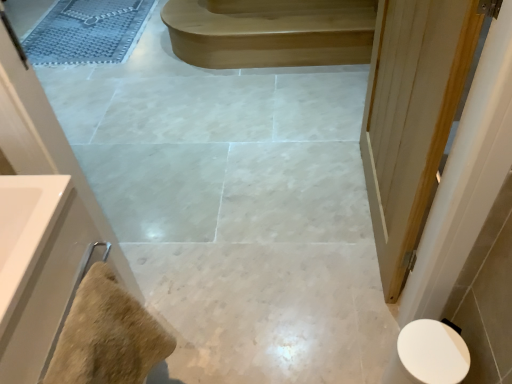
Question: Could you tell me if light brown wood stair at upper center is turned towards beige textured towel at lower left?

Choices:
 (A) yes
 (B) no

Answer: (B)

Question: From a real-world perspective, is light brown wood stair at upper center on beige textured towel at lower left?

Choices:
 (A) no
 (B) yes

Answer: (A)

Question: Is light brown wood stair at upper center further to the viewer compared to beige textured towel at lower left?

Choices:
 (A) no
 (B) yes

Answer: (B)

Question: Is light brown wood stair at upper center positioned before beige textured towel at lower left?

Choices:
 (A) no
 (B) yes

Answer: (A)

Question: Can you confirm if light brown wood stair at upper center is shorter than beige textured towel at lower left?

Choices:
 (A) yes
 (B) no

Answer: (A)

Question: In terms of width, does light brown wood stair at upper center look wider or thinner when compared to textured gray bath mat at upper left?

Choices:
 (A) thin
 (B) wide

Answer: (A)

Question: From the image's perspective, relative to textured gray bath mat at upper left, is light brown wood stair at upper center above or below?

Choices:
 (A) above
 (B) below

Answer: (B)

Question: From a real-world perspective, is light brown wood stair at upper center above or below textured gray bath mat at upper left?

Choices:
 (A) above
 (B) below

Answer: (A)

Question: Is point (261, 3) positioned closer to the camera than point (130, 51)?

Choices:
 (A) closer
 (B) farther

Answer: (A)

Question: In terms of width, does beige textured towel at lower left look wider or thinner when compared to white wood door at right?

Choices:
 (A) thin
 (B) wide

Answer: (B)

Question: From the image's perspective, is beige textured towel at lower left positioned above or below white wood door at right?

Choices:
 (A) below
 (B) above

Answer: (A)

Question: Is beige textured towel at lower left in front of or behind white wood door at right in the image?

Choices:
 (A) behind
 (B) front

Answer: (B)

Question: From a real-world perspective, relative to white wood door at right, is beige textured towel at lower left vertically above or below?

Choices:
 (A) below
 (B) above

Answer: (B)

Question: Is white glossy sink at left situated inside light brown wood stair at upper center or outside?

Choices:
 (A) inside
 (B) outside

Answer: (B)

Question: From the image's perspective, relative to light brown wood stair at upper center, is white glossy sink at left above or below?

Choices:
 (A) above
 (B) below

Answer: (B)